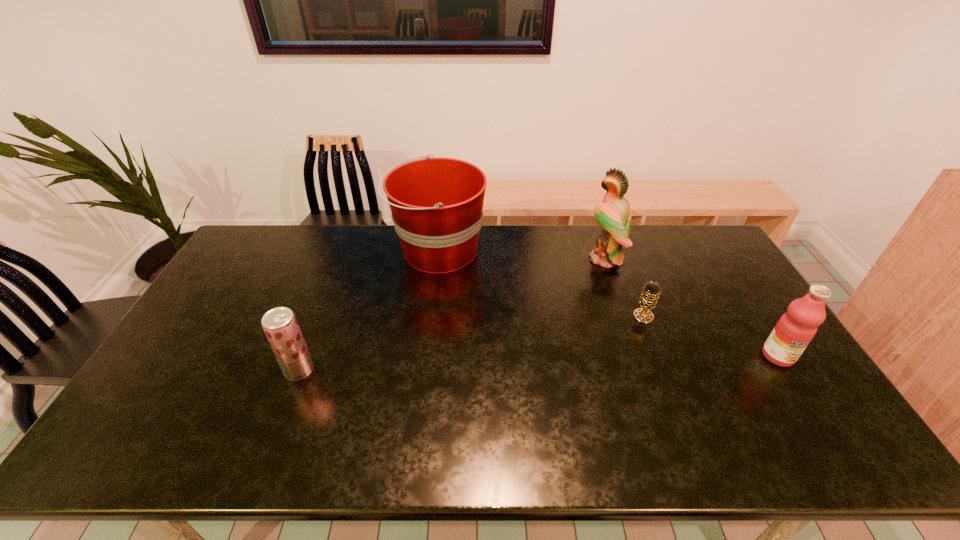
Where is `vacant area situated 0.230m on the front-facing side of the parrot`? The height and width of the screenshot is (540, 960). vacant area situated 0.230m on the front-facing side of the parrot is located at coordinates (522, 259).

At what (x,y) coordinates should I click in order to perform the action: click on blank space located on the front of the bucket. Please return your answer as a coordinate pair (x, y). The image size is (960, 540). Looking at the image, I should click on (431, 308).

Identify the location of vacant area located 0.210m on the label of the third tallest object. The image size is (960, 540). (831, 440).

This screenshot has height=540, width=960. In order to click on blank space located 0.260m on the back of the leftmost object in this screenshot , I will do `click(327, 295)`.

This screenshot has width=960, height=540. In order to click on blank area located 0.310m on the left of the chalice in this screenshot , I will do `click(532, 316)`.

Where is `parrot at the far edge`? parrot at the far edge is located at coordinates (614, 216).

This screenshot has height=540, width=960. Find the location of `bucket present at the far edge`. bucket present at the far edge is located at coordinates (437, 203).

Where is `object at the right edge`? The image size is (960, 540). object at the right edge is located at coordinates (795, 329).

Where is `vacant space at the far edge of the desktop`? The height and width of the screenshot is (540, 960). vacant space at the far edge of the desktop is located at coordinates (644, 261).

Identify the location of blank area at the near edge. (487, 431).